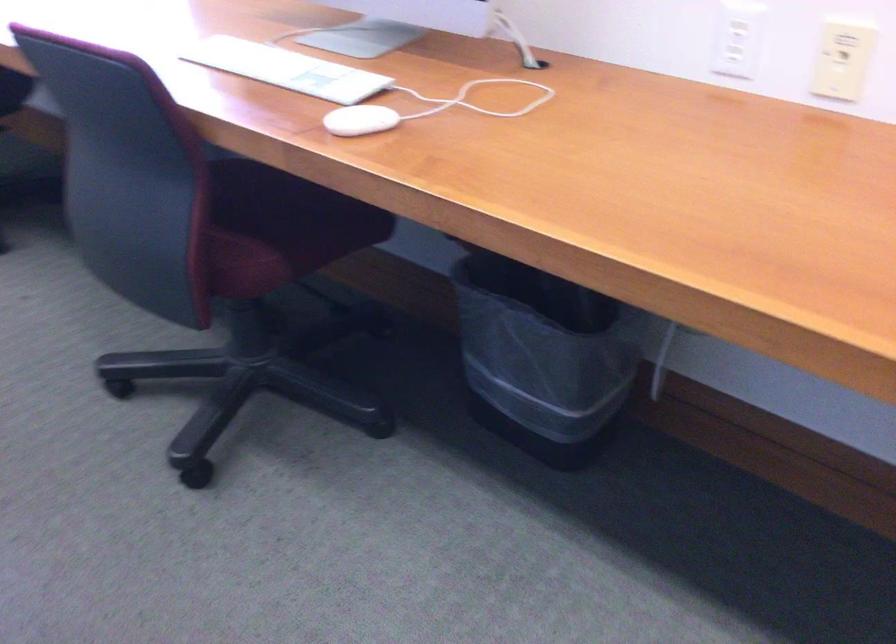
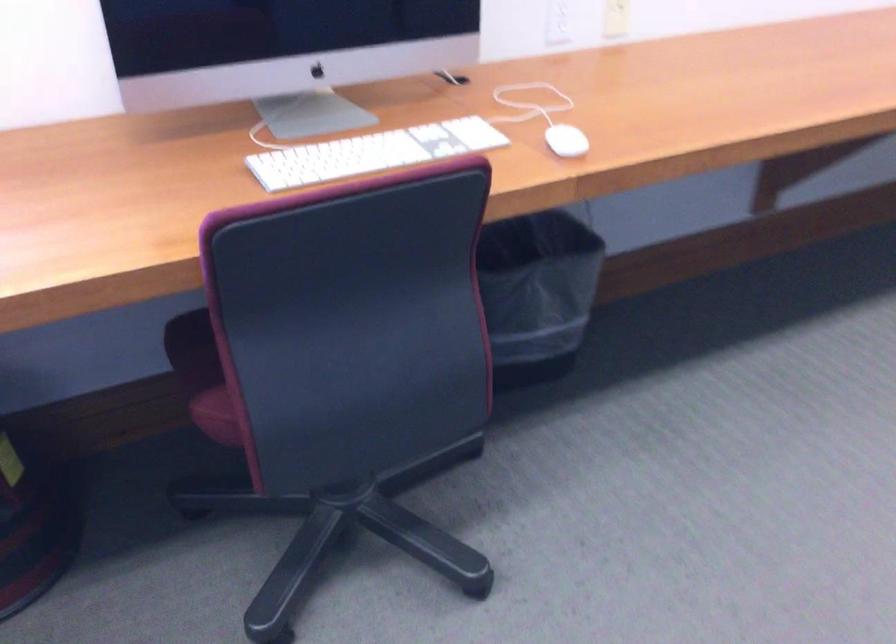
Locate, in the second image, the point that corresponds to the point at 276,67 in the first image.

(372, 153)